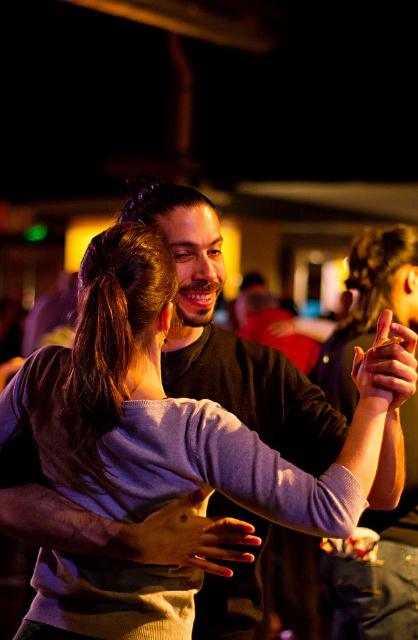
You are a photographer at the event and want to capture a photo of the two people. Since the purple sweater at center and the smooth skin hand at center are in the frame, which one is to the right of the other?

The purple sweater at center is positioned on the right side of smooth skin hand at center, so the purple sweater at center is to the right of the smooth skin hand at center.